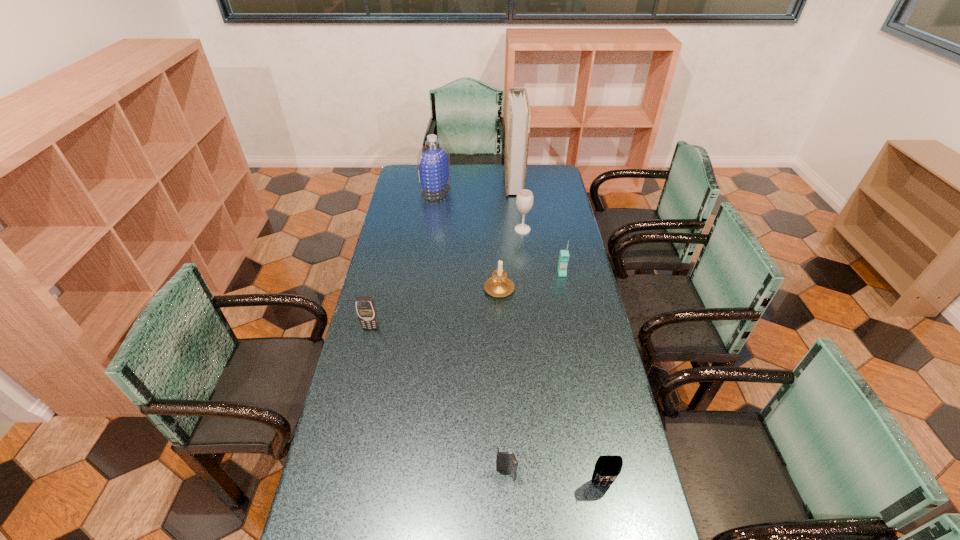
Where is `free point at the far right corner`? This screenshot has height=540, width=960. free point at the far right corner is located at coordinates (554, 170).

Image resolution: width=960 pixels, height=540 pixels. I want to click on unoccupied position between the farthest cellular telephone and the leftmost cellular telephone, so click(467, 300).

In order to click on unoccupied position between the second farthest cellular telephone and the candle holder in this screenshot , I will do `click(435, 307)`.

Locate an element on the screen. free space that is in between the farthest cellular telephone and the candle holder is located at coordinates (531, 280).

Where is `free space between the farthest cellular telephone and the shortest cellular telephone`? The height and width of the screenshot is (540, 960). free space between the farthest cellular telephone and the shortest cellular telephone is located at coordinates (534, 374).

Locate an element on the screen. This screenshot has height=540, width=960. vacant space that is in between the farthest cellular telephone and the phonebook is located at coordinates (538, 228).

Where is `unoccupied position between the seventh shortest object and the shortest cellular telephone`? Image resolution: width=960 pixels, height=540 pixels. unoccupied position between the seventh shortest object and the shortest cellular telephone is located at coordinates (471, 333).

This screenshot has height=540, width=960. I want to click on free spot between the third tallest object and the leftmost cellular telephone, so click(446, 279).

Choose which object is the second nearest neighbor to the candle holder. Please provide its 2D coordinates. Your answer should be formatted as a tuple, i.e. [(x, y)], where the tuple contains the x and y coordinates of a point satisfying the conditions above.

[(524, 201)]

Identify which object is located as the third nearest to the second cellular telephone from left to right. Please provide its 2D coordinates. Your answer should be formatted as a tuple, i.e. [(x, y)], where the tuple contains the x and y coordinates of a point satisfying the conditions above.

[(499, 285)]